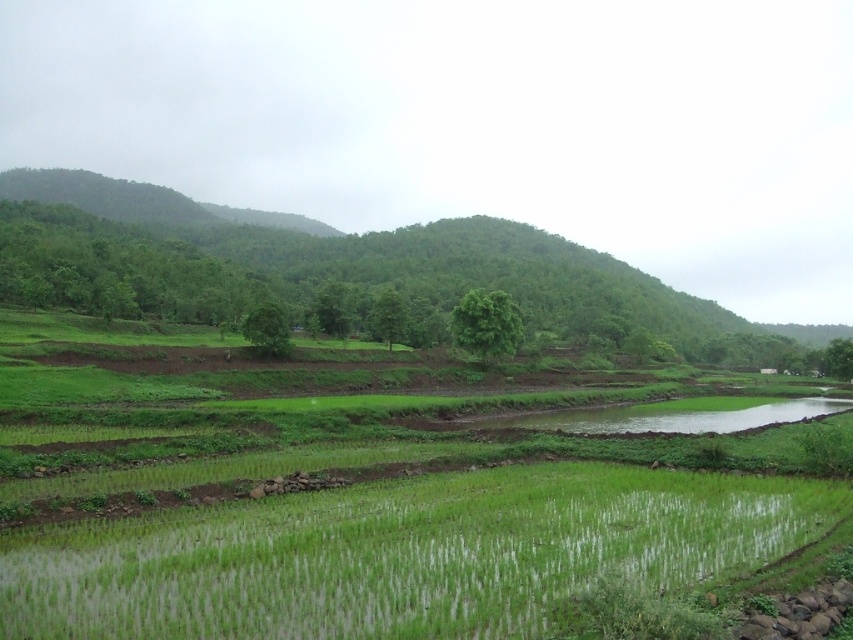
Question: Does green grassy rice field at lower center appear on the right side of green leafy hillside at center?

Choices:
 (A) yes
 (B) no

Answer: (B)

Question: Which of the following is the closest to the observer?

Choices:
 (A) green grassy rice field at lower center
 (B) green leafy hillside at center

Answer: (A)

Question: Which point is closer to the camera taking this photo?

Choices:
 (A) (218, 298)
 (B) (71, 579)

Answer: (B)

Question: Can you confirm if green grassy rice field at lower center is bigger than green leafy hillside at center?

Choices:
 (A) no
 (B) yes

Answer: (A)

Question: Which point is farther from the camera taking this photo?

Choices:
 (A) [x=466, y=284]
 (B) [x=457, y=621]

Answer: (A)

Question: Can you confirm if green grassy rice field at lower center is positioned to the right of green leafy hillside at center?

Choices:
 (A) no
 (B) yes

Answer: (A)